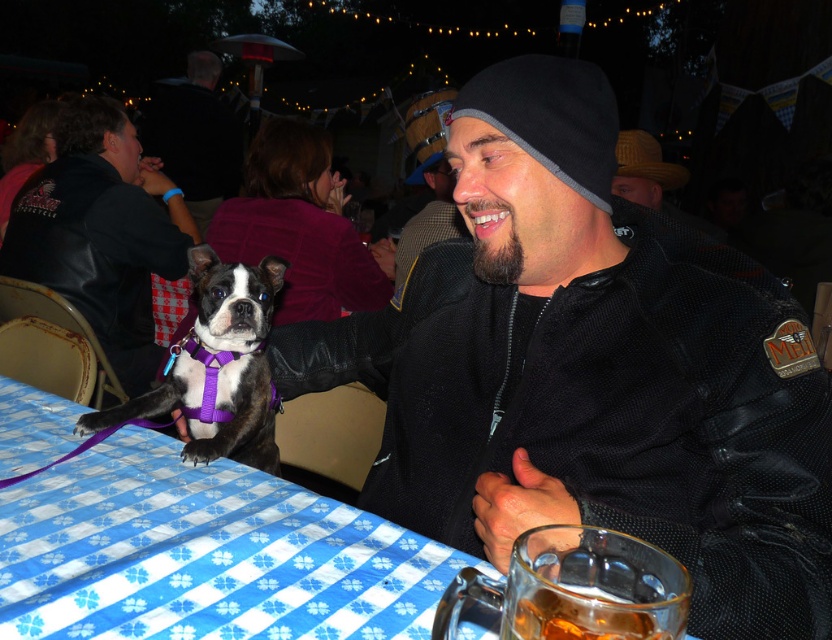
You are at the festive event and want to place a small decoration on the table. Which object, the translucent glass mug at lower right or the black and white fur at center, is shorter and thus better suited for placing the decoration on top?

The translucent glass mug at lower right is shorter than the black and white fur at center, so placing the decoration on top of the translucent glass mug at lower right would be more stable.

You are at the festive event and want to grab the translucent glass mug at lower right without disturbing the black and white fur at center. Which direction should you move your hand to reach it?

The translucent glass mug at lower right is to the right of the black and white fur at center, so you should move your hand to the right to reach it.

What is the location of the point with coordinates [204,554] in the image?

The point with coordinates [204,554] corresponds to the blue checkered tablecloth at lower left.